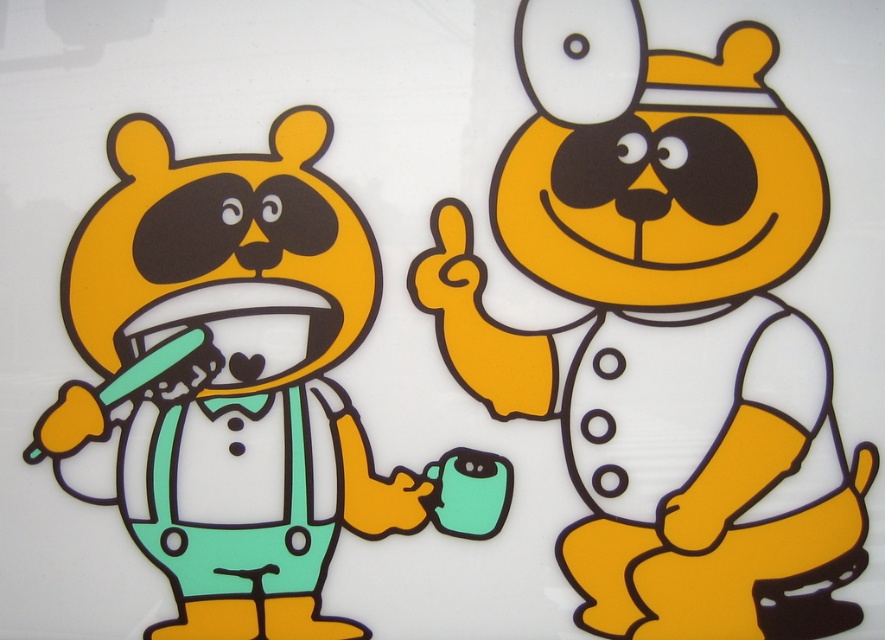
Question: Is matte plastic bear at center bigger than matte green toothbrush at left?

Choices:
 (A) yes
 (B) no

Answer: (A)

Question: Among these objects, which one is nearest to the camera?

Choices:
 (A) matte green toothbrush at left
 (B) matte plastic bear at center

Answer: (B)

Question: Does matte plastic bear at center have a lesser width compared to matte green toothbrush at left?

Choices:
 (A) yes
 (B) no

Answer: (A)

Question: Which point is farther from the camera taking this photo?

Choices:
 (A) (x=329, y=252)
 (B) (x=653, y=609)

Answer: (B)

Question: Is matte plastic bear at center positioned before matte green toothbrush at left?

Choices:
 (A) no
 (B) yes

Answer: (B)